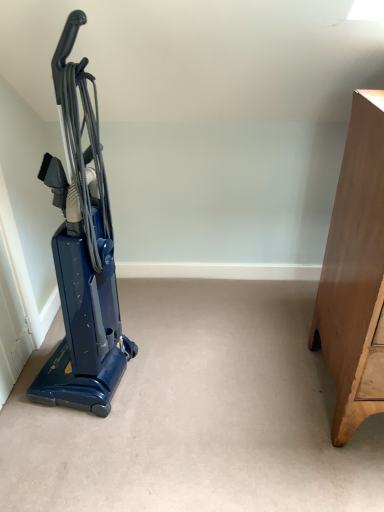
Find the location of a particular element. This screenshot has width=384, height=512. vacant space in front of blue glossy vacuum cleaner at left is located at coordinates (78, 448).